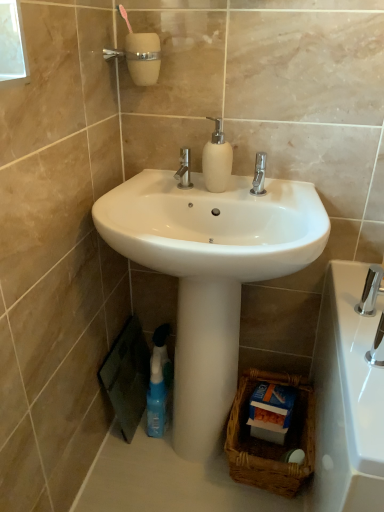
The image size is (384, 512). What do you see at coordinates (205, 362) in the screenshot?
I see `white glossy pedestal at center` at bounding box center [205, 362].

What is the approximate width of white glossy pedestal at center?

20.43 centimeters.

Locate an element on the screen. The height and width of the screenshot is (512, 384). polished chrome tap at lower right is located at coordinates (371, 290).

Image resolution: width=384 pixels, height=512 pixels. Describe the element at coordinates (371, 290) in the screenshot. I see `polished chrome tap at lower right` at that location.

Find the location of `brown woven basket at lower right`. brown woven basket at lower right is located at coordinates (269, 442).

Image resolution: width=384 pixels, height=512 pixels. In order to click on blue plastic spray bottle at lower left in this screenshot , I will do `click(156, 398)`.

Where is `white glossy pedestal at center`? The image size is (384, 512). white glossy pedestal at center is located at coordinates (205, 362).

Is blue plastic spray bottle at lower left inside the boundaries of brown woven basket at lower right, or outside?

blue plastic spray bottle at lower left is not enclosed by brown woven basket at lower right.

Which of these two, blue plastic spray bottle at lower left or brown woven basket at lower right, stands taller?

With more height is blue plastic spray bottle at lower left.

Could you tell me if blue plastic spray bottle at lower left is facing brown woven basket at lower right?

No, blue plastic spray bottle at lower left is not turned towards brown woven basket at lower right.

Is the depth of blue plastic spray bottle at lower left less than that of brown woven basket at lower right?

No, the depth of blue plastic spray bottle at lower left is greater than that of brown woven basket at lower right.

Based on the photo, is white glossy pedestal at center to the left of polished chrome faucet at lower right from the viewer's perspective?

Yes, white glossy pedestal at center is to the left of polished chrome faucet at lower right.

Is the position of white glossy pedestal at center more distant than that of polished chrome faucet at lower right?

Yes, white glossy pedestal at center is further from the viewer.

Is white glossy pedestal at center in contact with polished chrome faucet at lower right?

white glossy pedestal at center and polished chrome faucet at lower right are not in contact.

Can you tell me how much white glossy pedestal at center and polished chrome faucet at lower right differ in facing direction?

90.1 degrees separate the facing orientations of white glossy pedestal at center and polished chrome faucet at lower right.

Is polished chrome faucet at lower right to the left of matte white soap dispenser at center from the viewer's perspective?

No.

From a real-world perspective, is polished chrome faucet at lower right physically located above or below matte white soap dispenser at center?

From a real-world perspective, polished chrome faucet at lower right is physically below matte white soap dispenser at center.

Is polished chrome faucet at lower right directly adjacent to matte white soap dispenser at center?

They are not placed beside each other.

Between polished chrome tap at lower right and white glossy pedestal at center, which one has larger width?

With larger width is white glossy pedestal at center.

From the image's perspective, who appears lower, polished chrome tap at lower right or white glossy pedestal at center?

white glossy pedestal at center appears lower in the image.

Can you confirm if polished chrome tap at lower right is smaller than white glossy pedestal at center?

Indeed, polished chrome tap at lower right has a smaller size compared to white glossy pedestal at center.

Which object is positioned more to the left, polished chrome tap at lower right or white glossy pedestal at center?

white glossy pedestal at center is more to the left.

Who is more distant, blue plastic spray bottle at lower left or matte white soap dispenser at center?

blue plastic spray bottle at lower left is further away from the camera.

Who is smaller, blue plastic spray bottle at lower left or matte white soap dispenser at center?

matte white soap dispenser at center is smaller.

From the picture: From the image's perspective, which object appears higher, blue plastic spray bottle at lower left or matte white soap dispenser at center?

matte white soap dispenser at center.

Considering the relative sizes of blue plastic spray bottle at lower left and matte white soap dispenser at center in the image provided, is blue plastic spray bottle at lower left thinner than matte white soap dispenser at center?

No.

Between white glossy pedestal at center and brown woven basket at lower right, which one appears on the left side from the viewer's perspective?

white glossy pedestal at center is more to the left.

Where is `pillar located above the brown woven basket at lower right (from a real-world perspective)`? Image resolution: width=384 pixels, height=512 pixels. pillar located above the brown woven basket at lower right (from a real-world perspective) is located at coordinates (205, 362).

Is the surface of white glossy pedestal at center in direct contact with brown woven basket at lower right?

No, white glossy pedestal at center is not in contact with brown woven basket at lower right.

Is white glossy pedestal at center oriented towards brown woven basket at lower right?

No.

Which of these two, polished chrome tap at lower right or matte white soap dispenser at center, is wider?

With larger width is polished chrome tap at lower right.

Would you say polished chrome tap at lower right is inside or outside matte white soap dispenser at center?

polished chrome tap at lower right is located beyond the bounds of matte white soap dispenser at center.

Are polished chrome tap at lower right and matte white soap dispenser at center beside each other?

polished chrome tap at lower right is not next to matte white soap dispenser at center, and they're not touching.

Consider the image. Is polished chrome tap at lower right to the left or to the right of matte white soap dispenser at center in the image?

From the image, it's evident that polished chrome tap at lower right is to the right of matte white soap dispenser at center.

The image size is (384, 512). Identify the location of cleaning product that is above the brown woven basket at lower right (from a real-world perspective). (156, 398).

The image size is (384, 512). What are the coordinates of `pillar behind the polished chrome faucet at lower right` in the screenshot? It's located at (205, 362).

From the image, which object appears to be nearer to blue plastic spray bottle at lower left, white glossy pedestal at center or matte white soap dispenser at center?

The object closer to blue plastic spray bottle at lower left is white glossy pedestal at center.

Estimate the real-world distances between objects in this image. Which object is further from matte white soap dispenser at center, blue plastic spray bottle at lower left or white glossy pedestal at center?

Among the two, blue plastic spray bottle at lower left is located further to matte white soap dispenser at center.

Based on their spatial positions, is polished chrome faucet at lower right or polished chrome tap at lower right further from blue plastic spray bottle at lower left?

polished chrome faucet at lower right is further to blue plastic spray bottle at lower left.

Which object lies nearer to the anchor point white glossy pedestal at center, brown woven basket at lower right or matte white soap dispenser at center?

brown woven basket at lower right is closer to white glossy pedestal at center.

Which object lies further to the anchor point polished chrome tap at lower right, matte white soap dispenser at center or white glossy sink at center?

The object further to polished chrome tap at lower right is matte white soap dispenser at center.

When comparing their distances from white glossy sink at center, does blue plastic spray bottle at lower left or polished chrome faucet at lower right seem further?

blue plastic spray bottle at lower left is further to white glossy sink at center.

Based on their spatial positions, is brown woven basket at lower right or matte white soap dispenser at center closer to polished chrome faucet at lower right?

brown woven basket at lower right is closer to polished chrome faucet at lower right.

Estimate the real-world distances between objects in this image. Which object is closer to polished chrome tap at lower right, white glossy pedestal at center or polished chrome faucet at lower right?

polished chrome faucet at lower right is positioned closer to the anchor polished chrome tap at lower right.

In order to click on pillar that lies between white glossy sink at center and blue plastic spray bottle at lower left from top to bottom in this screenshot , I will do `click(205, 362)`.

Identify the location of tap between matte white soap dispenser at center and polished chrome faucet at lower right in the up-down direction. (371, 290).

This screenshot has height=512, width=384. Identify the location of sink between matte white soap dispenser at center and blue plastic spray bottle at lower left in the up-down direction. (214, 226).

Where is `tap between white glossy sink at center and brown woven basket at lower right from top to bottom`? tap between white glossy sink at center and brown woven basket at lower right from top to bottom is located at coordinates (371, 290).